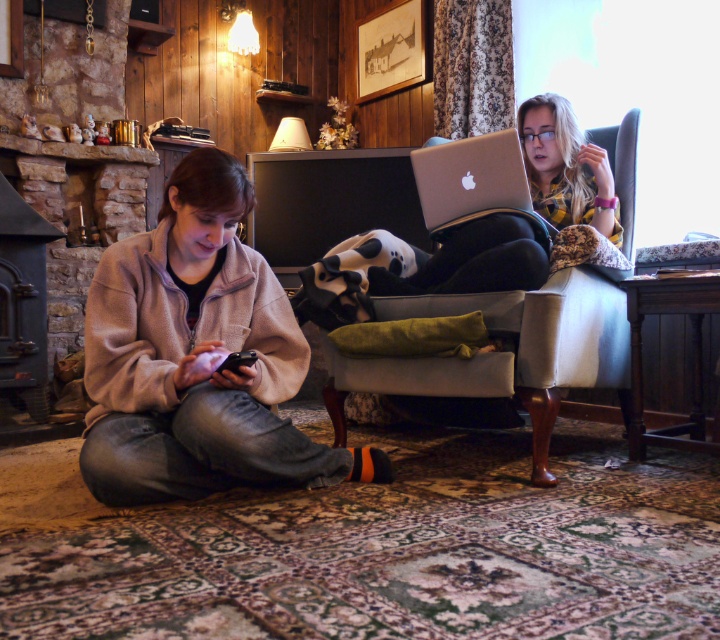
Question: Observing the image, what is the correct spatial positioning of beige fleece jacket at lower left in reference to blonde hair at upper right?

Choices:
 (A) right
 (B) left

Answer: (B)

Question: Among these objects, which one is nearest to the camera?

Choices:
 (A) blonde hair at upper right
 (B) silver metallic laptop at upper right
 (C) beige fleece jacket at lower left

Answer: (C)

Question: Is silver metallic armchair at center wider than black cast iron fireplace at left?

Choices:
 (A) no
 (B) yes

Answer: (B)

Question: Among these points, which one is farthest from the camera?

Choices:
 (A) (18, 316)
 (B) (468, 160)
 (C) (570, 214)
 (D) (441, 362)

Answer: (A)

Question: Which of the following is the farthest from the observer?

Choices:
 (A) (544, 404)
 (B) (571, 332)
 (C) (36, 278)
 (D) (438, 182)

Answer: (C)

Question: Is beige fleece jacket at lower left above black cast iron fireplace at left?

Choices:
 (A) no
 (B) yes

Answer: (B)